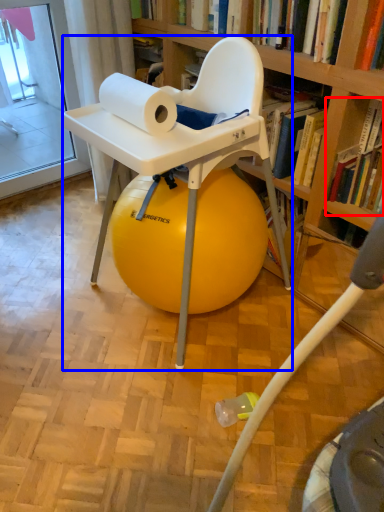
Question: Which point is further to the camera, book (highlighted by a red box) or chair (highlighted by a blue box)?

Choices:
 (A) book
 (B) chair

Answer: (A)